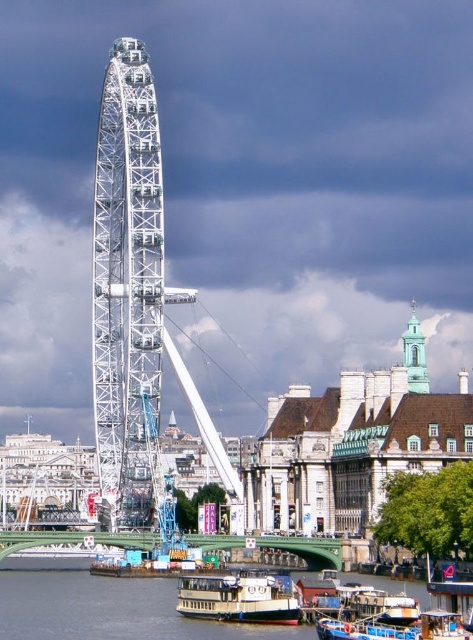
Question: Is smooth water at lower center to the left of blue painted wooden boat at lower center from the viewer's perspective?

Choices:
 (A) yes
 (B) no

Answer: (A)

Question: Which point is farther to the camera?

Choices:
 (A) light blue glass tower at upper right
 (B) smooth water at lower center
 (C) white wooden boat at lower center

Answer: (A)

Question: Can you confirm if smooth water at lower center is positioned below light blue glass tower at upper right?

Choices:
 (A) yes
 (B) no

Answer: (A)

Question: Which point is farther to the camera?

Choices:
 (A) (357, 634)
 (B) (402, 355)

Answer: (B)

Question: Among these objects, which one is nearest to the camera?

Choices:
 (A) smooth water at lower center
 (B) light blue glass tower at upper right
 (C) blue painted wooden boat at lower center
 (D) white wooden boat at lower center

Answer: (C)

Question: Is blue painted wooden boat at lower center wider than light blue glass tower at upper right?

Choices:
 (A) no
 (B) yes

Answer: (A)